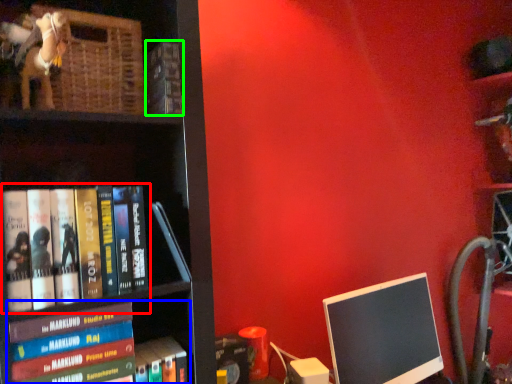
Question: Considering the real-world distances, which object is farthest from book (highlighted by a red box)? book (highlighted by a blue box) or book (highlighted by a green box)?

Choices:
 (A) book
 (B) book

Answer: (B)